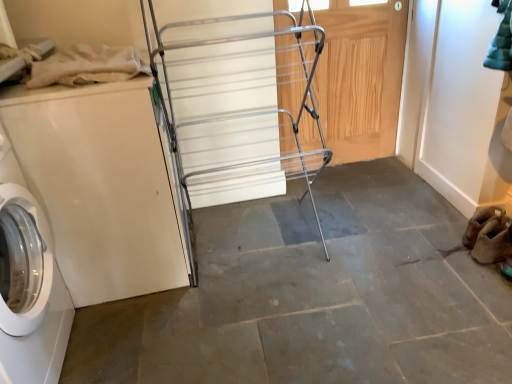
Question: Would you say white glossy washing machine at left contains wooden door at center?

Choices:
 (A) yes
 (B) no

Answer: (B)

Question: From a real-world perspective, does white glossy washing machine at left stand above wooden door at center?

Choices:
 (A) yes
 (B) no

Answer: (B)

Question: Is white glossy washing machine at left to the left of wooden door at center from the viewer's perspective?

Choices:
 (A) yes
 (B) no

Answer: (A)

Question: Is there a large distance between white glossy washing machine at left and wooden door at center?

Choices:
 (A) no
 (B) yes

Answer: (B)

Question: Is white glossy washing machine at left shorter than wooden door at center?

Choices:
 (A) no
 (B) yes

Answer: (B)

Question: Is white glossy washing machine at left positioned in front of wooden door at center?

Choices:
 (A) yes
 (B) no

Answer: (A)

Question: Is silver metallic drying rack at center behind white glossy washing machine at left?

Choices:
 (A) yes
 (B) no

Answer: (B)

Question: Is silver metallic drying rack at center smaller than white glossy washing machine at left?

Choices:
 (A) yes
 (B) no

Answer: (B)

Question: From the image's perspective, does silver metallic drying rack at center appear lower than white glossy washing machine at left?

Choices:
 (A) no
 (B) yes

Answer: (A)

Question: Is silver metallic drying rack at center at the right side of white glossy washing machine at left?

Choices:
 (A) yes
 (B) no

Answer: (A)

Question: From the image's perspective, is silver metallic drying rack at center above white glossy washing machine at left?

Choices:
 (A) yes
 (B) no

Answer: (A)

Question: Is white glossy washing machine at left surrounded by silver metallic drying rack at center?

Choices:
 (A) yes
 (B) no

Answer: (B)

Question: Is white glossy washing machine at left oriented away from silver metallic drying rack at center?

Choices:
 (A) no
 (B) yes

Answer: (A)